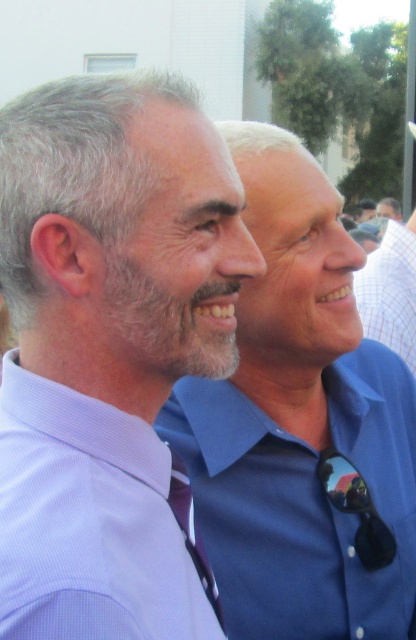
You are a photographer who needs to adjust the lighting to ensure both the purple satin tie at center and the matte blue shirt at center are well lit. Since the sun is coming from the right side, which object might need more light adjustment? Explain your reasoning based on their positions.

The purple satin tie at center is to the left of the matte blue shirt at center. Since the sun is coming from the right, the purple satin tie at center might be in shadow and require more light adjustment to ensure proper illumination compared to the matte blue shirt at center which is positioned towards the light source.

You are a photographer trying to capture the purple satin tie at center in the image. The camera is set to focus on the point at coordinates point (190, 529). Can you confirm if this point is correctly positioned to focus on the purple satin tie at center?

Yes, the point (190, 529) is correctly positioned to focus on the purple satin tie at center because the Objects Description states that this point corresponds to the purple satin tie at center.

You are a photographer adjusting your camera settings. You notice the matte purple tie at left and the matte blue shirt at center in your frame. Which object should you focus on first if you want to capture both clearly? Please explain based on their positions.

The matte purple tie at left is located below the matte blue shirt at center. To capture both clearly, focus on the matte blue shirt at center first since it is closer to the camera. Then adjust the focus slightly downward to include the matte purple tie at left in the frame.